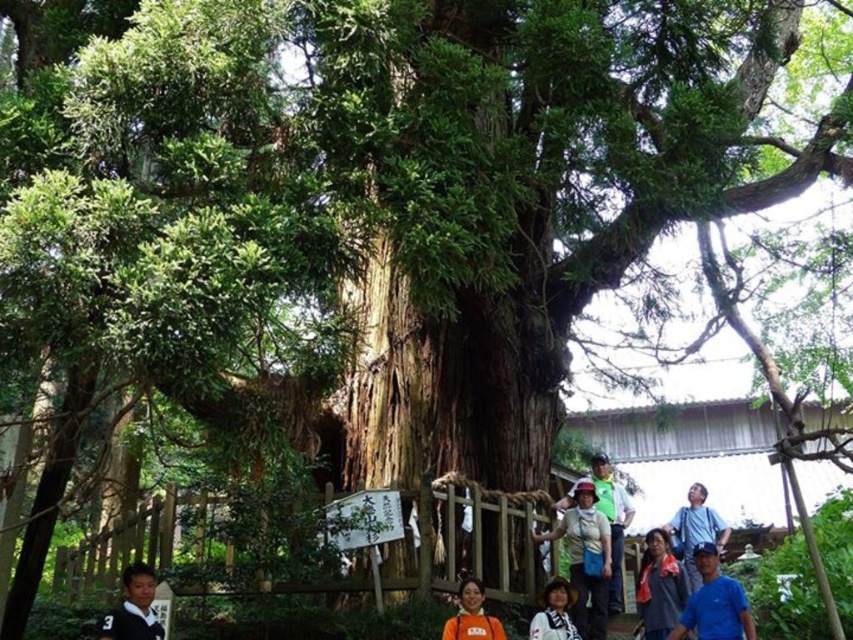
You are a photographer trying to capture a person wearing a matte blue shirt at center and a white fabric hat at lower center. Based on the scene, where should you position yourself to ensure both items are visible in your shot?

Position yourself to the left of the white fabric hat at lower center so that the matte blue shirt at center appears to the right of it in the frame.

You are standing in front of the ancient tree and want to take a photo of the matte black shirt at lower center. If your camera has a maximum focus range of 6 meters, will it be able to capture the shirt clearly?

The matte black shirt at lower center is 6.17 meters away from the camera. Since the camera can only focus up to 6 meters, it won want be able to capture the shirt clearly.

You are a hiker who has just arrived at the scene. You see a blue shirt at lower right and an orange fabric bag at lower center. Which item is closer to the ancient tree?

The blue shirt at lower right is positioned under orange fabric bag at lower center, meaning it is closer to the ancient tree.